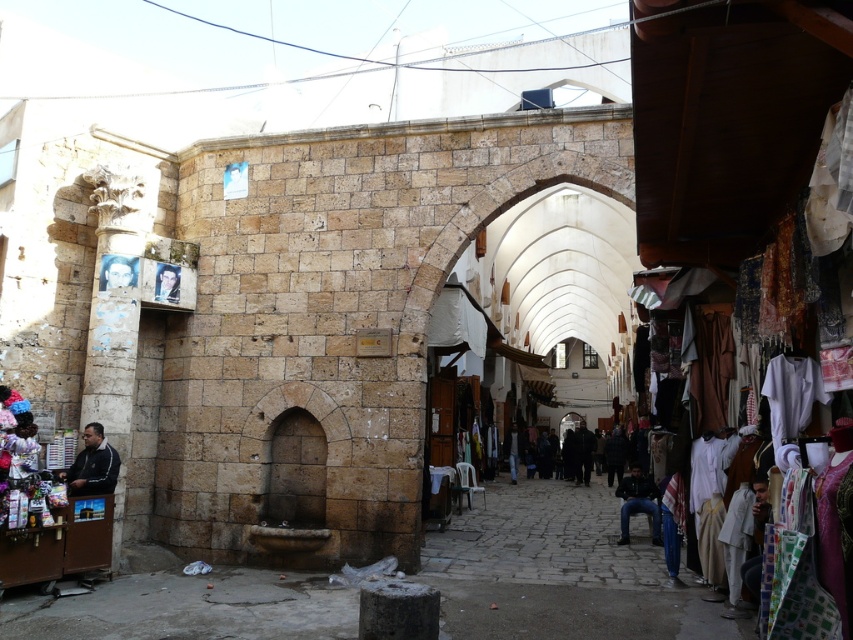
Between dark gray fabric jacket at lower left and dark blue jeans at lower right, which one appears on the left side from the viewer's perspective?

dark gray fabric jacket at lower left is more to the left.

Is point (80, 477) positioned in front of point (619, 493)?

Yes, it is.

Locate an element on the screen. The height and width of the screenshot is (640, 853). dark gray fabric jacket at lower left is located at coordinates (91, 465).